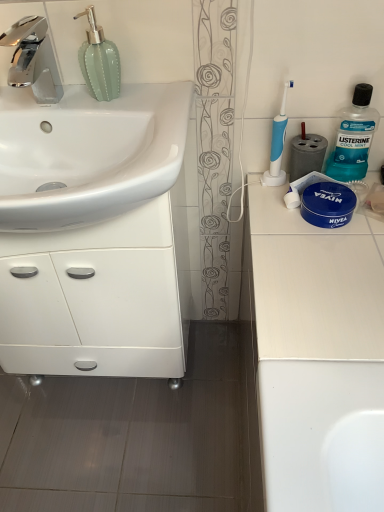
Question: Is white glossy sink at left positioned in front of white glossy cabinet at left?

Choices:
 (A) yes
 (B) no

Answer: (A)

Question: Is white glossy sink at left looking in the opposite direction of white glossy cabinet at left?

Choices:
 (A) yes
 (B) no

Answer: (A)

Question: Is white glossy sink at left not near white glossy cabinet at left?

Choices:
 (A) yes
 (B) no

Answer: (B)

Question: Is white glossy sink at left to the left of white glossy cabinet at left from the viewer's perspective?

Choices:
 (A) yes
 (B) no

Answer: (B)

Question: Considering the relative sizes of white glossy sink at left and white glossy cabinet at left in the image provided, is white glossy sink at left smaller than white glossy cabinet at left?

Choices:
 (A) no
 (B) yes

Answer: (B)

Question: Is blue plastic toothbrush at upper right bigger or smaller than teal plastic mouthwash at upper right?

Choices:
 (A) small
 (B) big

Answer: (A)

Question: Would you say blue plastic toothbrush at upper right is to the left or to the right of teal plastic mouthwash at upper right in the picture?

Choices:
 (A) left
 (B) right

Answer: (A)

Question: Considering the positions of point (284, 133) and point (352, 146), is point (284, 133) closer or farther from the camera than point (352, 146)?

Choices:
 (A) closer
 (B) farther

Answer: (A)

Question: From a real-world perspective, is blue plastic toothbrush at upper right physically located above or below teal plastic mouthwash at upper right?

Choices:
 (A) below
 (B) above

Answer: (B)

Question: From their relative heights in the image, would you say chrome metallic faucet at upper left is taller or shorter than white glossy cabinet at left?

Choices:
 (A) short
 (B) tall

Answer: (A)

Question: From the image's perspective, is chrome metallic faucet at upper left positioned above or below white glossy cabinet at left?

Choices:
 (A) below
 (B) above

Answer: (B)

Question: Is chrome metallic faucet at upper left bigger or smaller than white glossy cabinet at left?

Choices:
 (A) big
 (B) small

Answer: (B)

Question: Choose the correct answer: Is chrome metallic faucet at upper left inside white glossy cabinet at left or outside it?

Choices:
 (A) inside
 (B) outside

Answer: (B)

Question: In terms of width, does white glossy sink at left look wider or thinner when compared to teal plastic mouthwash at upper right?

Choices:
 (A) wide
 (B) thin

Answer: (A)

Question: Considering the positions of white glossy sink at left and teal plastic mouthwash at upper right in the image, is white glossy sink at left bigger or smaller than teal plastic mouthwash at upper right?

Choices:
 (A) small
 (B) big

Answer: (B)